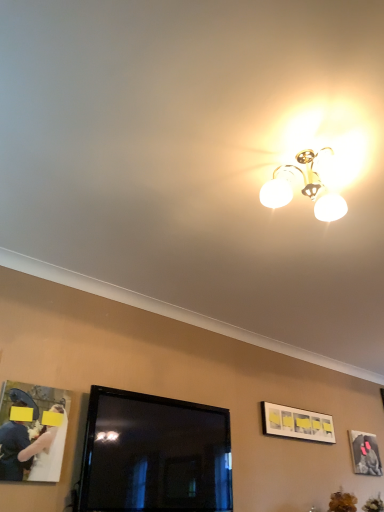
Question: Does point (374, 440) appear closer or farther from the camera than point (148, 484)?

Choices:
 (A) farther
 (B) closer

Answer: (A)

Question: From a real-world perspective, is matte black picture frame at upper right, the 1th picture frame viewed from the back, positioned above or below black glossy tv at center?

Choices:
 (A) below
 (B) above

Answer: (B)

Question: Estimate the real-world distances between objects in this image. Which object is farther from the white satin dress at lower left?

Choices:
 (A) matte black picture frame at upper right, marked as the second picture frame in a front-to-back arrangement
 (B) black glossy tv at center
 (C) white matte picture frame at upper right, the second picture frame viewed from the right

Answer: (A)

Question: Which of these objects is positioned farthest from the black glossy tv at center?

Choices:
 (A) matte black picture frame at upper right, marked as the second picture frame in a front-to-back arrangement
 (B) white satin dress at lower left
 (C) white matte picture frame at upper right, marked as the first picture frame in a top-to-bottom arrangement

Answer: (A)